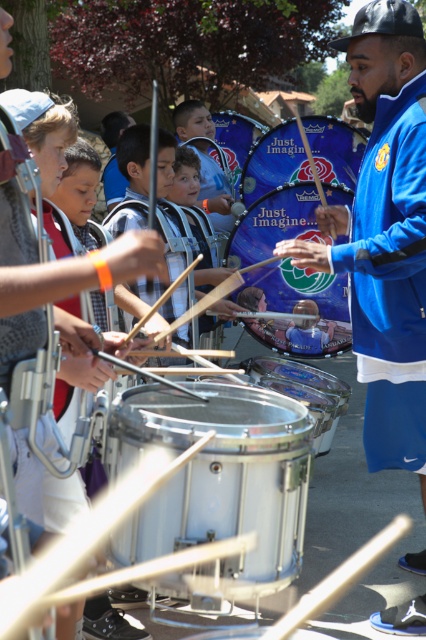
Question: Which object is farther from the camera taking this photo?

Choices:
 (A) shiny blue drum at center
 (B) blue drum at center
 (C) blue fabric jacket at center

Answer: (A)

Question: Can you confirm if shiny silver drum at center is wider than blue drum at center?

Choices:
 (A) no
 (B) yes

Answer: (A)

Question: Is blue fabric jacket at center positioned in front of blue fabric drum at center?

Choices:
 (A) yes
 (B) no

Answer: (A)

Question: Which point is closer to the camera?

Choices:
 (A) blue fabric jacket at center
 (B) shiny blue drum at center
 (C) blue fleece jacket at right
 (D) blue drum at center

Answer: (A)

Question: Does blue drum at center come in front of blue fabric drum at center?

Choices:
 (A) no
 (B) yes

Answer: (B)

Question: Among these objects, which one is nearest to the camera?

Choices:
 (A) blue drum at center
 (B) shiny blue drum at center

Answer: (A)